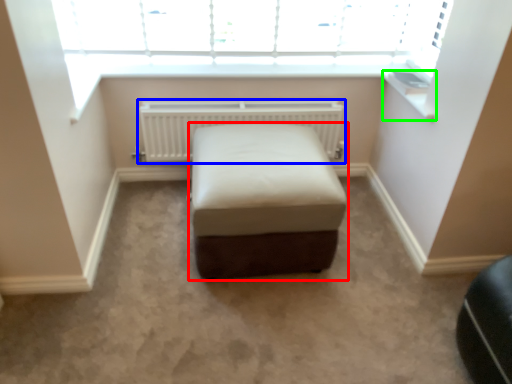
Question: Which is nearer to the furniture (highlighted by a red box)? radiator (highlighted by a blue box) or window sill (highlighted by a green box).

Choices:
 (A) radiator
 (B) window sill

Answer: (A)